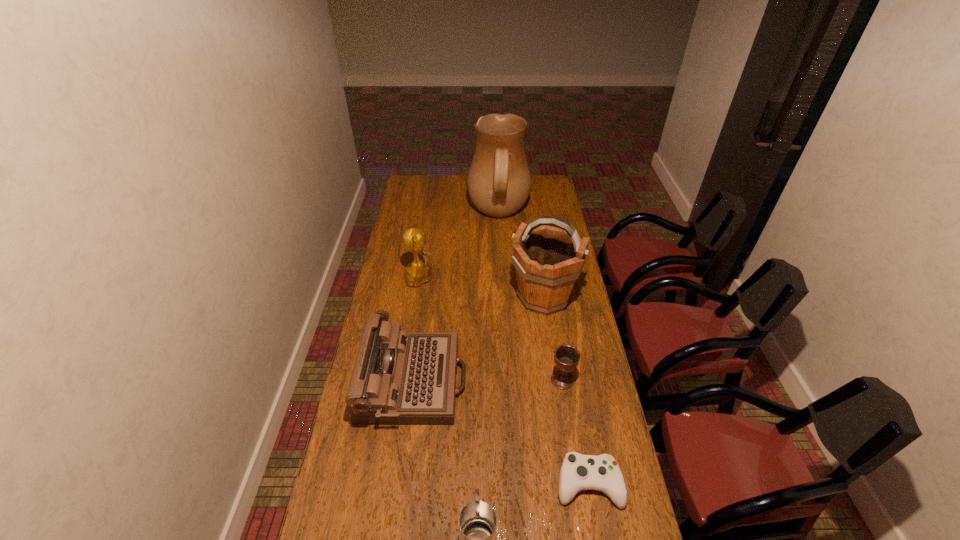
At what (x,y) coordinates should I click in order to perform the action: click on object that can be found as the fifth closest to the award. Please return your answer as a coordinate pair (x, y). This screenshot has width=960, height=540. Looking at the image, I should click on (578, 472).

Identify which object is the fourth closest to the chalice. Please provide its 2D coordinates. Your answer should be formatted as a tuple, i.e. [(x, y)], where the tuple contains the x and y coordinates of a point satisfying the conditions above.

[(477, 521)]

Locate an element on the screen. Image resolution: width=960 pixels, height=540 pixels. vacant position in the image that satisfies the following two spatial constraints: 1. at the spout of the control; 2. on the left side of the cream pitcher is located at coordinates (514, 484).

Find the location of a particular element. Image resolution: width=960 pixels, height=540 pixels. free spot that satisfies the following two spatial constraints: 1. on the front side of the bucket; 2. on the right side of the chalice is located at coordinates (556, 380).

Identify the location of free spot that satisfies the following two spatial constraints: 1. on the front side of the award; 2. on the left side of the chalice. (410, 380).

Find the location of a particular element. vacant space that satisfies the following two spatial constraints: 1. on the keyboard of the shortest object; 2. on the left side of the fourth shortest object is located at coordinates (400, 484).

The width and height of the screenshot is (960, 540). Find the location of `vacant space that satisfies the following two spatial constraints: 1. on the front side of the award; 2. on the back side of the chalice`. vacant space that satisfies the following two spatial constraints: 1. on the front side of the award; 2. on the back side of the chalice is located at coordinates (410, 380).

At what (x,y) coordinates should I click in order to perform the action: click on vacant space that satisfies the following two spatial constraints: 1. on the keyboard of the shortest object; 2. on the left side of the typewriter. Please return your answer as a coordinate pair (x, y). This screenshot has width=960, height=540. Looking at the image, I should click on 400,484.

Identify the location of free spot that satisfies the following two spatial constraints: 1. on the back side of the bucket; 2. at the spout of the farthest object. The image size is (960, 540). (531, 215).